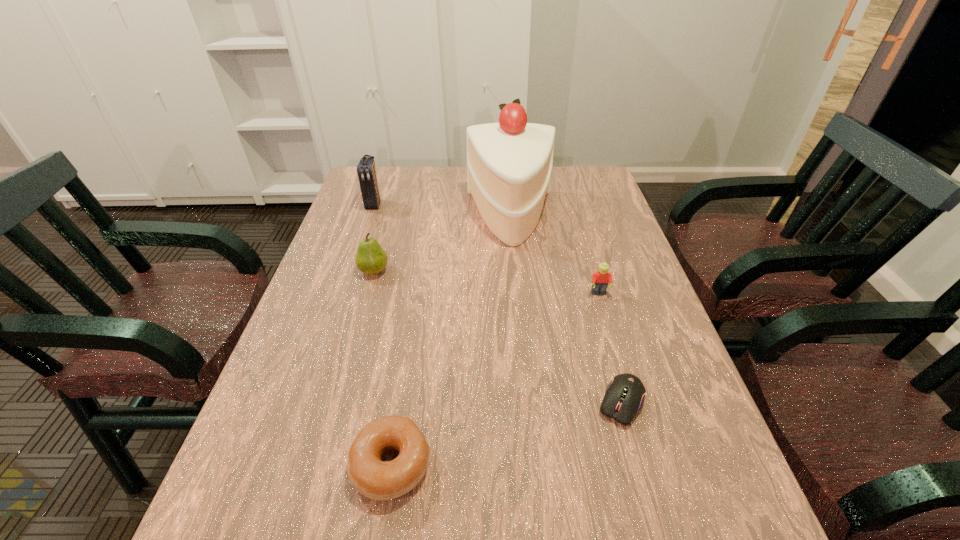
Identify the location of Lego that is at the right edge. This screenshot has height=540, width=960. (600, 279).

At what (x,y) coordinates should I click in order to perform the action: click on computer mouse that is positioned at the right edge. Please return your answer as a coordinate pair (x, y). Looking at the image, I should click on (624, 396).

Identify the location of object at the far left corner. (366, 170).

Image resolution: width=960 pixels, height=540 pixels. Identify the location of vacant region at the far edge. (408, 174).

In the image, there is a desktop. Where is `vacant space at the left edge`? This screenshot has height=540, width=960. vacant space at the left edge is located at coordinates (243, 457).

The height and width of the screenshot is (540, 960). Identify the location of free space at the right edge of the desktop. (711, 457).

At what (x,y) coordinates should I click in order to perform the action: click on vacant area at the far right corner. Please return your answer as a coordinate pair (x, y). Looking at the image, I should click on (567, 197).

At what (x,y) coordinates should I click in order to perform the action: click on empty space that is in between the pear and the second shortest object. Please return your answer as a coordinate pair (x, y). The image size is (960, 540). Looking at the image, I should click on (382, 368).

Locate an element on the screen. empty location between the tallest object and the fifth farthest object is located at coordinates (566, 310).

The height and width of the screenshot is (540, 960). I want to click on free space between the fourth tallest object and the cake, so click(x=555, y=255).